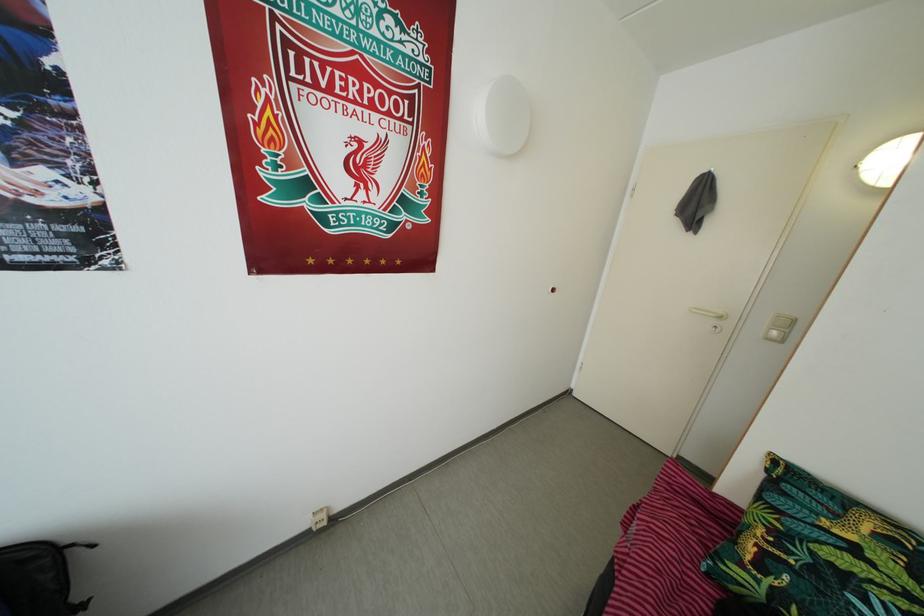
At what (x,y) coordinates should I click in order to perform the action: click on sofa sitting surface. Please return your answer as a coordinate pair (x, y). Looking at the image, I should click on (670, 548).